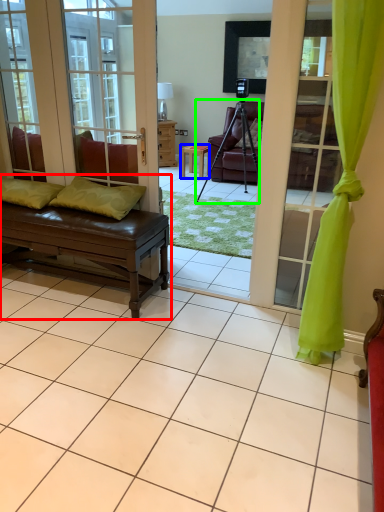
Question: Based on their relative distances, which object is nearer to studio couch (highlighted by a red box)? Choose from table (highlighted by a blue box) and tripod (highlighted by a green box).

Choices:
 (A) table
 (B) tripod

Answer: (B)